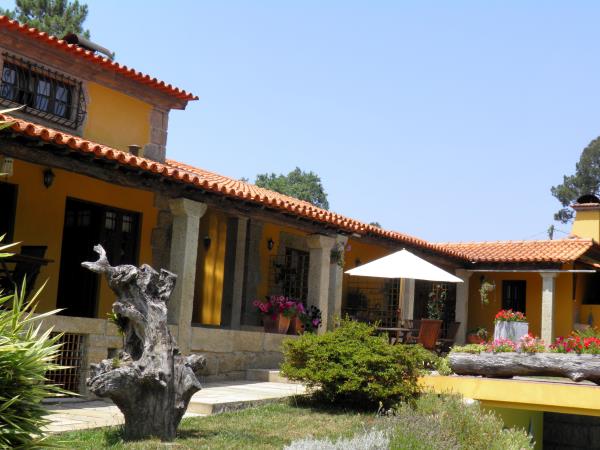
What are the coordinates of `grate` in the screenshot? It's located at (x=70, y=360).